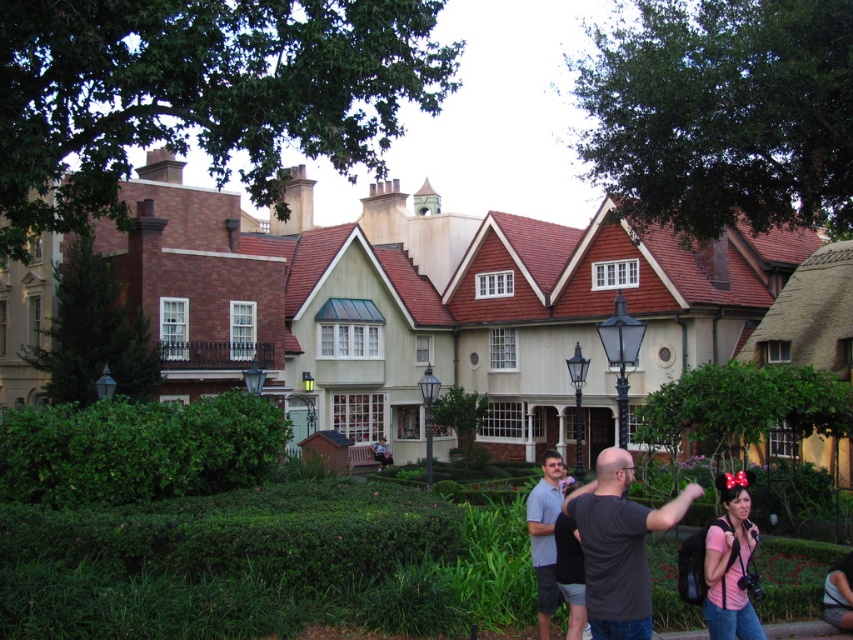
You are a photographer planning to take a wide shot of the matte beige house at center and the gray cotton shirt at center. Based on their sizes in the scene, which one would likely occupy more space in the photo?

The matte beige house at center is wider than the gray cotton shirt at center, so it would occupy more space in the photo.